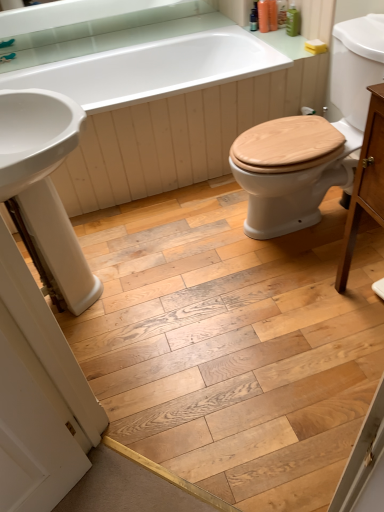
Where is `free space behind white glossy sink at left`? This screenshot has width=384, height=512. free space behind white glossy sink at left is located at coordinates (128, 223).